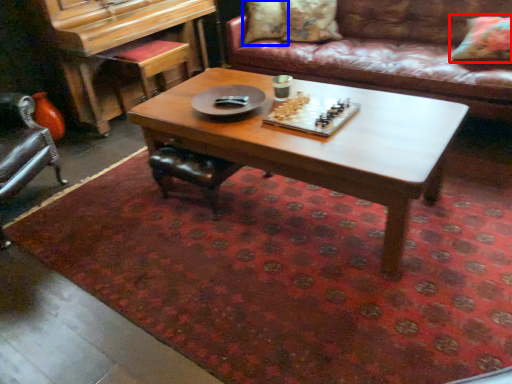
Question: Which object appears closest to the camera in this image, pillow (highlighted by a red box) or pillow (highlighted by a blue box)?

Choices:
 (A) pillow
 (B) pillow

Answer: (A)